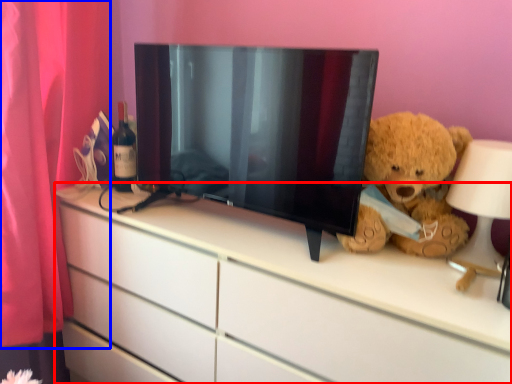
Question: Which object appears closest to the camera in this image, chest of drawers (highlighted by a red box) or curtain (highlighted by a blue box)?

Choices:
 (A) chest of drawers
 (B) curtain

Answer: (A)